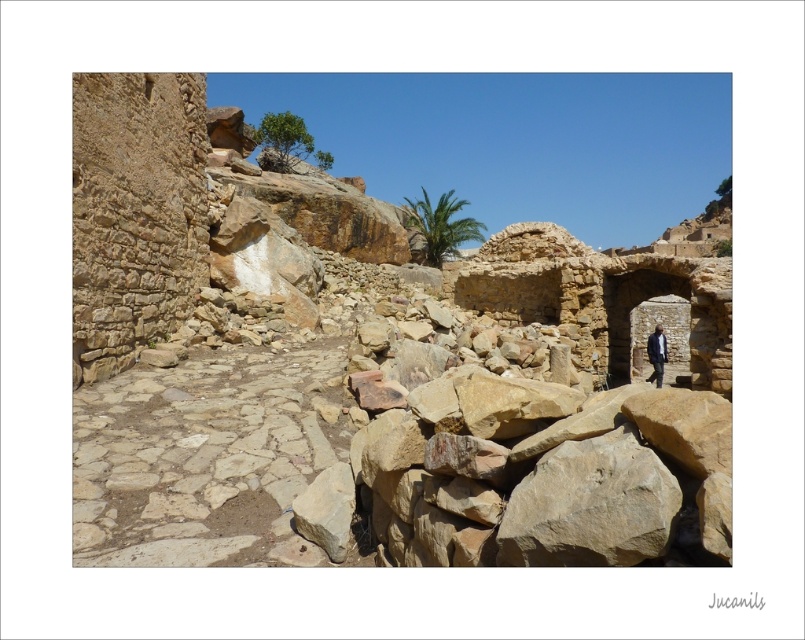
Question: Which of the following is the farthest from the observer?

Choices:
 (A) dark blue suit at right
 (B) green leafy palm at center

Answer: (B)

Question: Which point is farther from the camera taking this photo?

Choices:
 (A) (442, 259)
 (B) (574, 296)

Answer: (A)

Question: Is green leafy palm at center smaller than dark blue suit at right?

Choices:
 (A) yes
 (B) no

Answer: (B)

Question: Among these objects, which one is farthest from the camera?

Choices:
 (A) dark blue suit at right
 (B) brown stone ruins at center

Answer: (A)

Question: Can you confirm if brown stone ruins at center is wider than dark blue suit at right?

Choices:
 (A) no
 (B) yes

Answer: (B)

Question: Is brown stone ruins at center below dark blue suit at right?

Choices:
 (A) no
 (B) yes

Answer: (A)